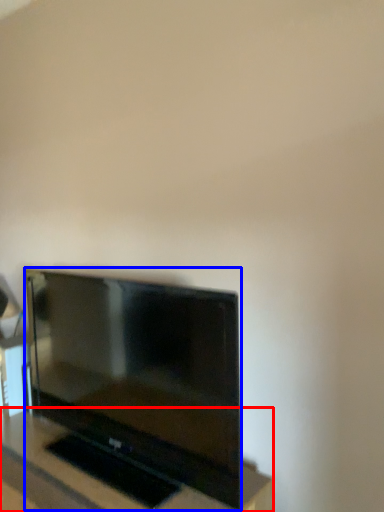
Question: Which point is closer to the camera, furniture (highlighted by a red box) or television (highlighted by a blue box)?

Choices:
 (A) furniture
 (B) television

Answer: (A)